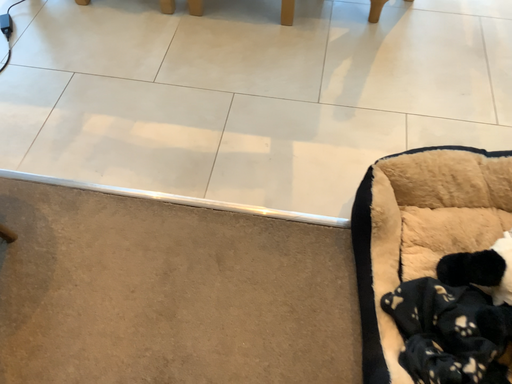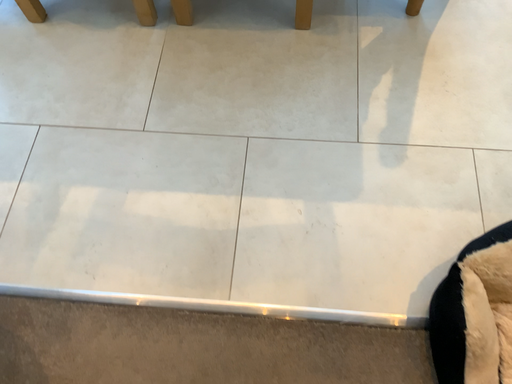
Question: How did the camera likely rotate when shooting the video?

Choices:
 (A) rotated upward
 (B) rotated downward

Answer: (B)